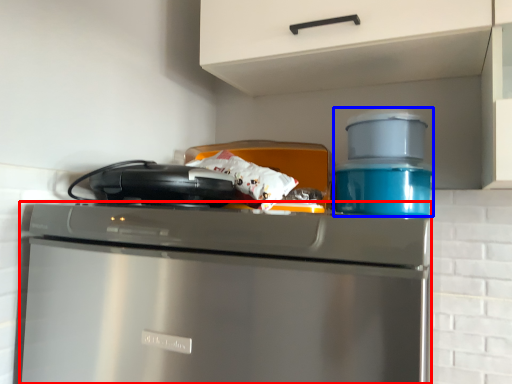
Question: Which object appears farthest to the camera in this image, home appliance (highlighted by a red box) or appliance (highlighted by a blue box)?

Choices:
 (A) home appliance
 (B) appliance

Answer: (B)